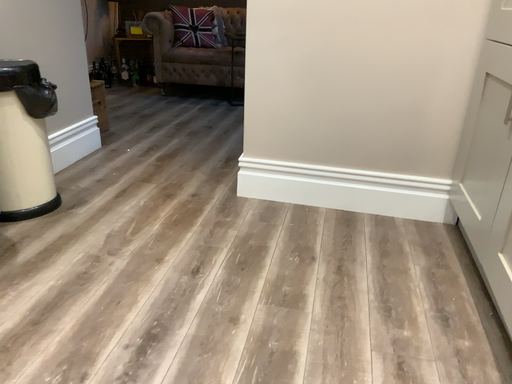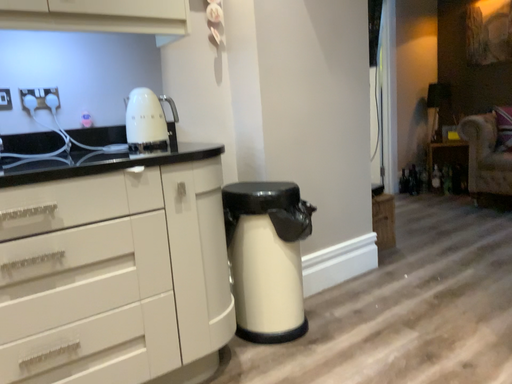
Question: How did the camera likely rotate when shooting the video?

Choices:
 (A) rotated downward
 (B) rotated upward

Answer: (B)